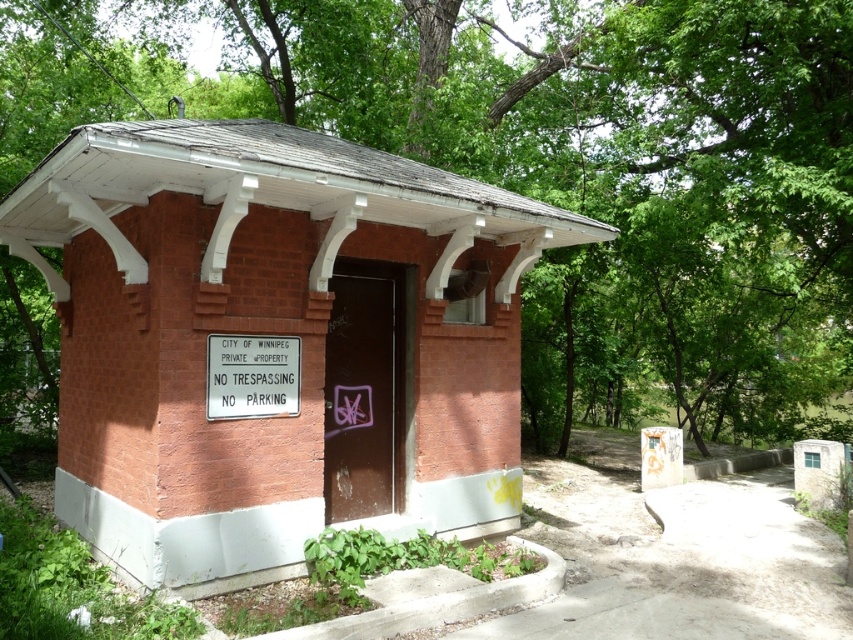
Question: Which object is positioned closest to the white plastic sign at center?

Choices:
 (A) brick hut at center
 (B) green leafy tree at upper center

Answer: (A)

Question: Estimate the real-world distances between objects in this image. Which object is closer to the white plastic sign at center?

Choices:
 (A) green leafy tree at upper center
 (B) brick hut at center

Answer: (B)

Question: Can you confirm if brick hut at center is bigger than white plastic sign at center?

Choices:
 (A) yes
 (B) no

Answer: (A)

Question: Among these points, which one is farthest from the camera?

Choices:
 (A) (608, 300)
 (B) (135, 576)

Answer: (A)

Question: Is brick hut at center positioned at the back of green leafy tree at upper center?

Choices:
 (A) yes
 (B) no

Answer: (B)

Question: Is green leafy tree at upper center smaller than white plastic sign at center?

Choices:
 (A) no
 (B) yes

Answer: (A)